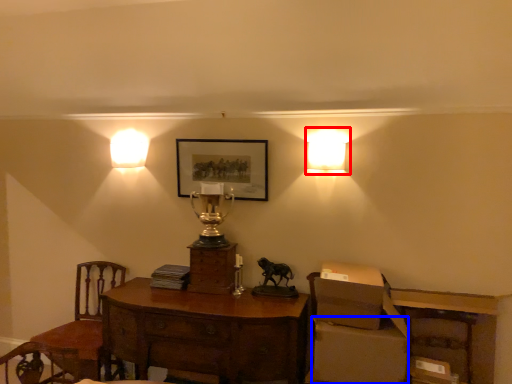
Question: Which point is further to the camera, lamp (highlighted by a red box) or cardboard box (highlighted by a blue box)?

Choices:
 (A) lamp
 (B) cardboard box

Answer: (A)